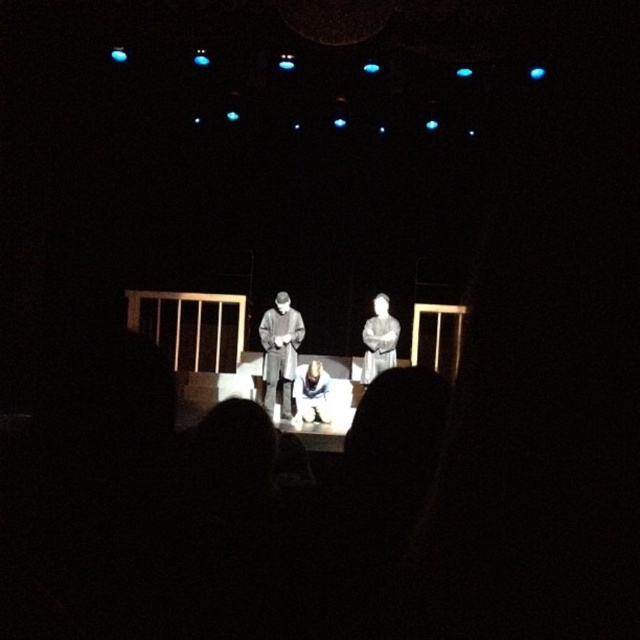
Question: Is gray fabric coat at center in front of white fabric at center?

Choices:
 (A) no
 (B) yes

Answer: (A)

Question: Which object appears closest to the camera in this image?

Choices:
 (A) smooth gray robe at center
 (B) gray fabric coat at center

Answer: (B)

Question: Which of the following is the closest to the observer?

Choices:
 (A) smooth gray robe at center
 (B) gray fabric coat at center
 (C) white fabric at center

Answer: (C)

Question: Is the position of gray fabric coat at center less distant than that of smooth gray robe at center?

Choices:
 (A) yes
 (B) no

Answer: (A)

Question: Does gray fabric coat at center have a lesser width compared to white fabric at center?

Choices:
 (A) no
 (B) yes

Answer: (A)

Question: Which of the following is the closest to the observer?

Choices:
 (A) (305, 394)
 (B) (278, 358)
 (C) (381, 323)

Answer: (B)